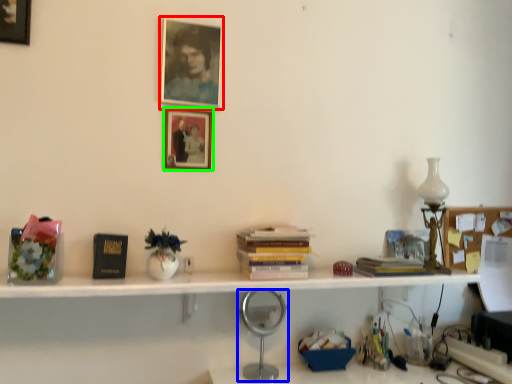
Question: Based on their relative distances, which object is nearer to picture frame (highlighted by a red box)? Choose from table lamp (highlighted by a blue box) and picture frame (highlighted by a green box).

Choices:
 (A) table lamp
 (B) picture frame

Answer: (B)